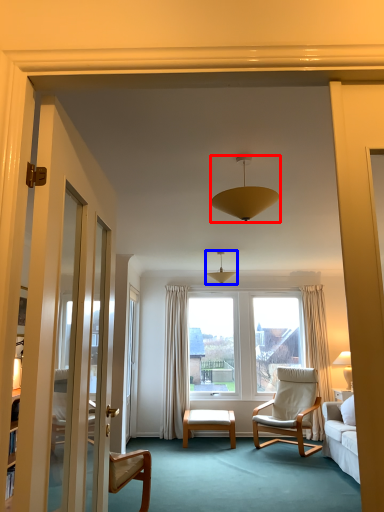
Question: Which point is closer to the camera, lamp (highlighted by a red box) or light fixture (highlighted by a blue box)?

Choices:
 (A) lamp
 (B) light fixture

Answer: (A)